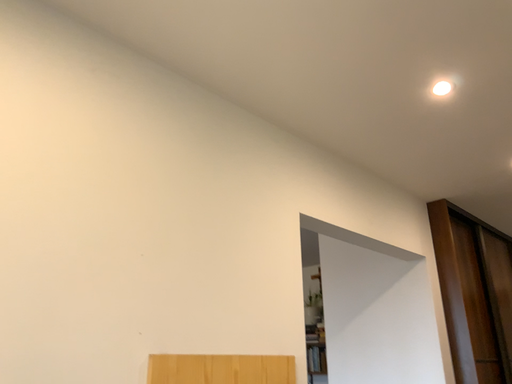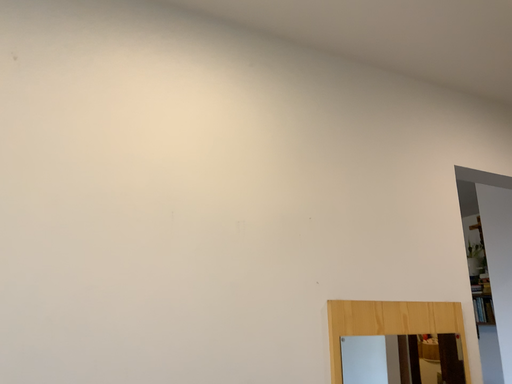
Question: How did the camera likely rotate when shooting the video?

Choices:
 (A) rotated upward
 (B) rotated downward

Answer: (B)